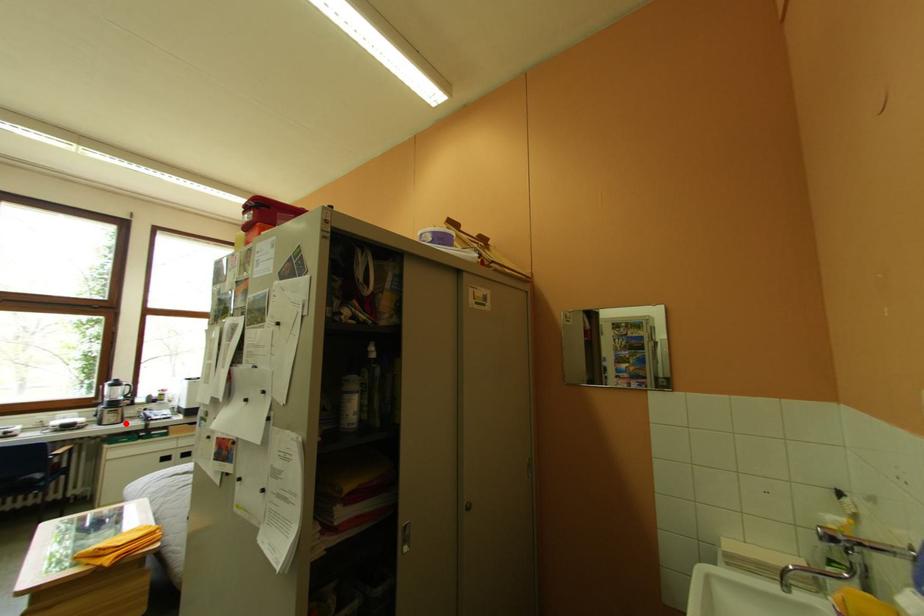
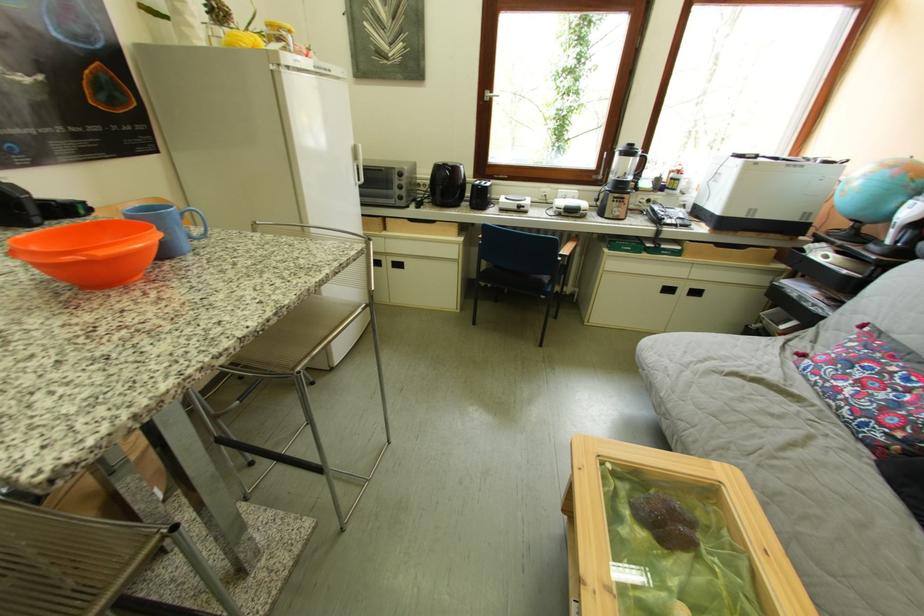
Where in the second image is the point corresponding to the highlighted location from the first image?

(629, 217)